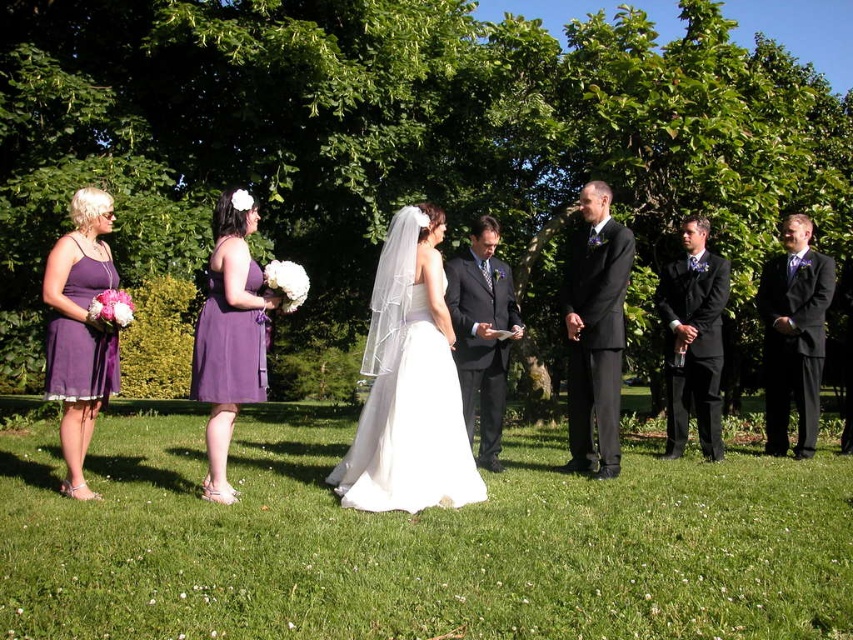
You are a photographer at the wedding ceremony and want to capture a photo of both the purple satin dress at left and the purple satin dress at center without any obstruction. Based on their positions, which dress should you focus on first to ensure both are visible in the frame?

The purple satin dress at center is behind the purple satin dress at left. To ensure both are visible, focus on the purple satin dress at left first, then adjust the camera angle to include the one behind without obstruction.

You are standing at the center of the grassy lawn and want to walk to the point that is closer to you. Which point should you head towards, point [119,372] or point [778,324]?

You should head towards point [119,372] because it is closer to the viewer than point [778,324].